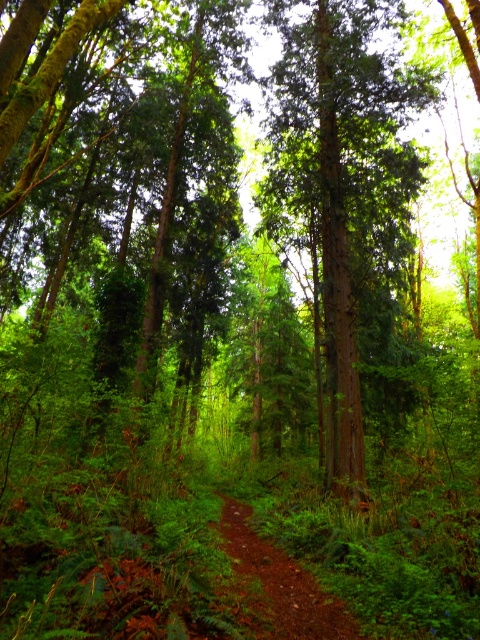
You are hiking along the damp dirt trail at center in the forest. You want to take a shortcut to the green rough bark tree at center. Which direction should you turn to reach it?

The green rough bark tree at center is to the right of the damp dirt trail at center, so you should turn right to reach it.

You are standing at the entrance of the forest and see the green rough bark tree at center. If you walk straight ahead, will the tree be directly in your path?

The green rough bark tree at center is positioned at point (342, 182), so if you walk straight ahead, the tree will be directly in your path.

You are a hiker who wants to follow the damp dirt trail at center. From your current position, which direction should you walk to go around the green rough bark tree at center blocking your path?

The damp dirt trail at center is behind the green rough bark tree at center, so you should walk behind the green rough bark tree at center to continue following the damp dirt trail at center.